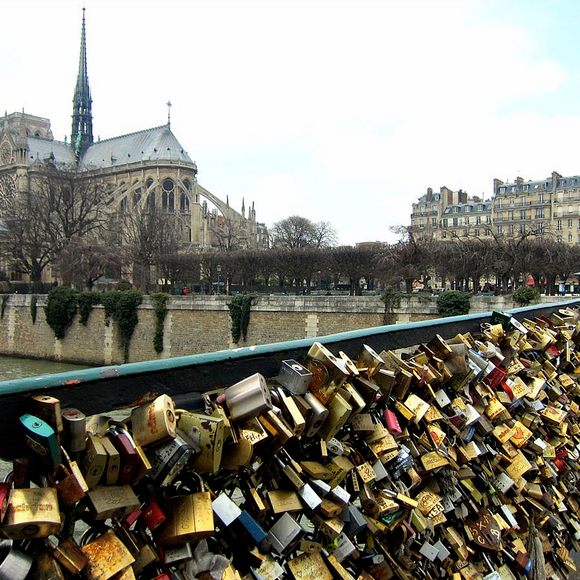
This screenshot has width=580, height=580. In order to click on locks in this screenshot , I will do `click(371, 472)`.